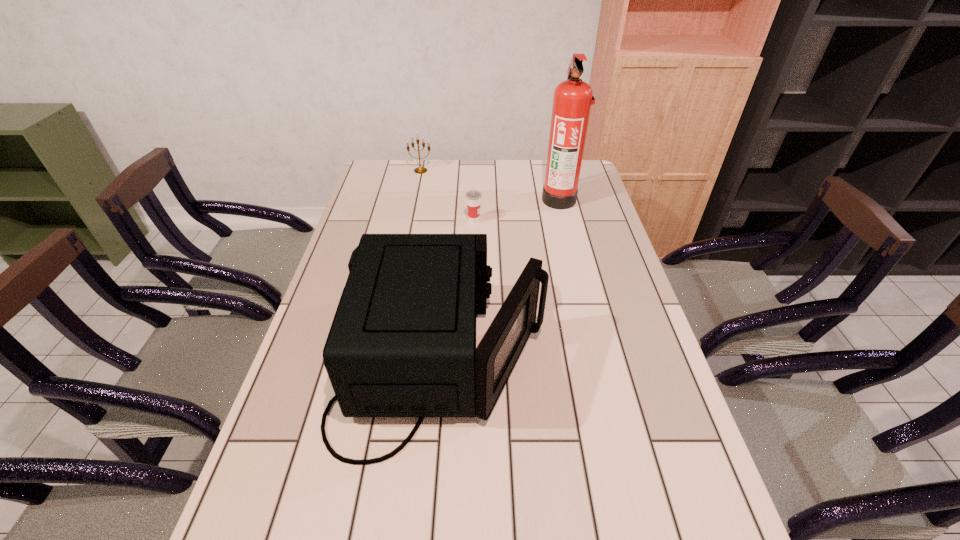
What are the coordinates of `vacant space located with the door open on the microwave oven` in the screenshot? It's located at pos(628,363).

You are a GUI agent. You are given a task and a screenshot of the screen. Output one action in this format:
    pyautogui.click(x=<x>, y=<y>)
    Task: Click on the vacant space located 0.150m on the right of the candelabrum
    
    Given the screenshot: What is the action you would take?
    pyautogui.click(x=470, y=171)

Image resolution: width=960 pixels, height=540 pixels. Identify the location of free space located on the side of the cup with the logo. (581, 221).

Find the location of `fire extinguisher located in the far edge section of the desktop`. fire extinguisher located in the far edge section of the desktop is located at coordinates (572, 101).

Locate an element on the screen. The width and height of the screenshot is (960, 540). candelabrum that is at the far edge is located at coordinates (419, 170).

Find the location of a particular element. The width and height of the screenshot is (960, 540). microwave oven present at the left edge is located at coordinates (402, 343).

This screenshot has height=540, width=960. Find the location of `candelabrum that is at the left edge`. candelabrum that is at the left edge is located at coordinates (419, 170).

The image size is (960, 540). Find the location of `object that is at the right edge`. object that is at the right edge is located at coordinates (572, 101).

Identify the location of object that is positioned at the far left corner. (419, 170).

Where is `object positioned at the far right corner`? object positioned at the far right corner is located at coordinates (572, 101).